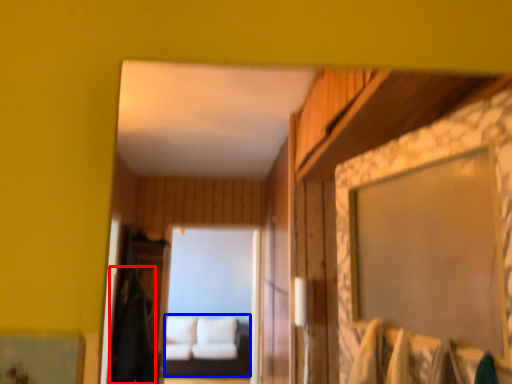
Question: Which point is closer to the camera, robe (highlighted by a red box) or couch (highlighted by a blue box)?

Choices:
 (A) robe
 (B) couch

Answer: (A)